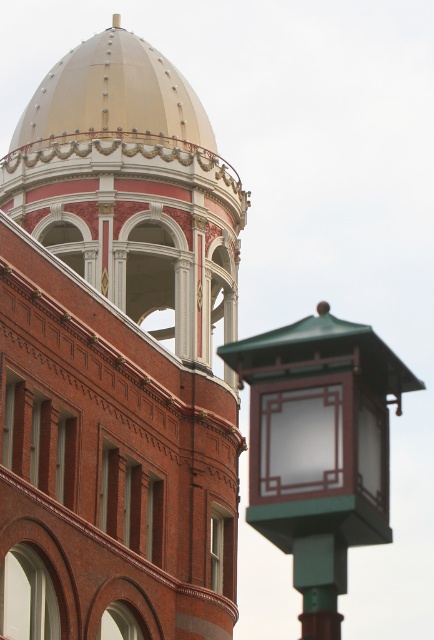
Is brick tower at center further to camera compared to green glass lantern at right?

Result: Yes, it is.

Is brick tower at center bigger than green glass lantern at right?

Yes, brick tower at center is bigger than green glass lantern at right.

Is point (36, 432) farther from camera compared to point (302, 538)?

Yes, it is behind point (302, 538).

Find the location of a particular element. Image resolution: width=434 pixels, height=640 pixels. brick tower at center is located at coordinates (117, 355).

Who is more distant from viewer, (x=322, y=368) or (x=105, y=42)?

The point (x=105, y=42) is more distant.

Does green glass lantern at right have a greater width compared to gold metallic dome at upper center?

No.

What do you see at coordinates (319, 449) in the screenshot? I see `green glass lantern at right` at bounding box center [319, 449].

What are the coordinates of `green glass lantern at right` in the screenshot? It's located at (319, 449).

Based on the photo, is brick tower at center further to camera compared to gold metallic dome at upper center?

No, it is in front of gold metallic dome at upper center.

Is point (191, 474) in front of point (36, 99)?

Yes, it is in front of point (36, 99).

Find the location of a particular element. The height and width of the screenshot is (640, 434). brick tower at center is located at coordinates (117, 355).